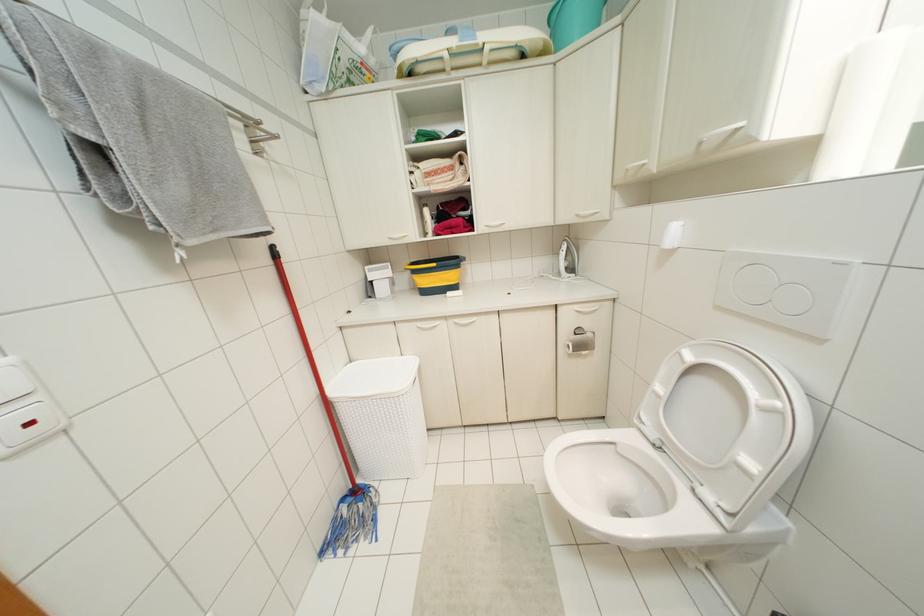
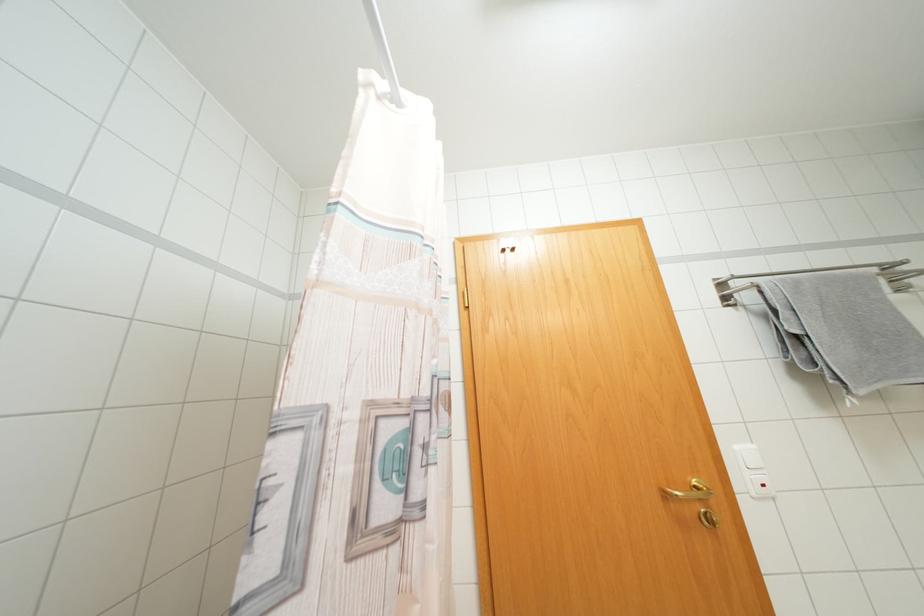
Question: The images are taken continuously from a first-person perspective. In which direction is your viewpoint rotating?

Choices:
 (A) Left
 (B) Right
 (C) Up
 (D) Down

Answer: (A)